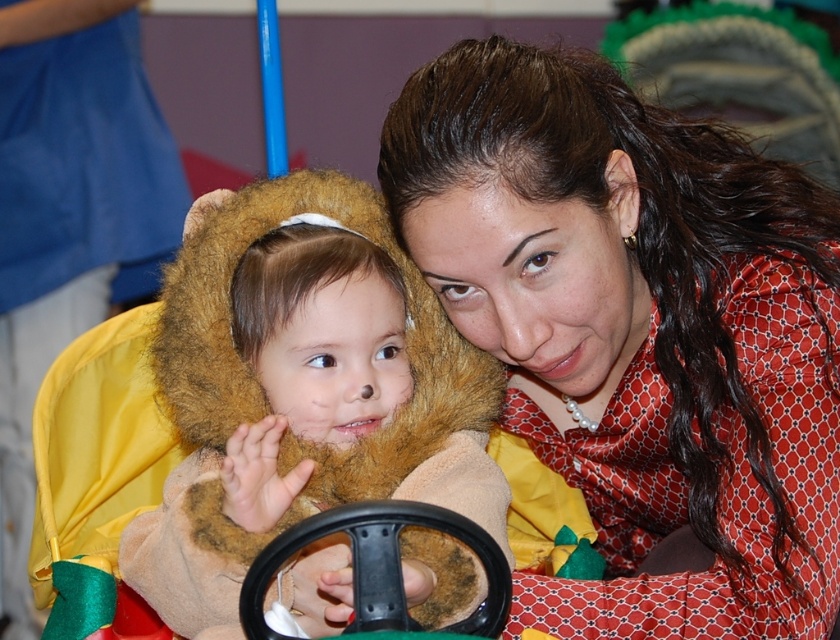
Can you confirm if smooth red blouse at upper right is shorter than fuzzy brown bear at center?

Incorrect, smooth red blouse at upper right's height does not fall short of fuzzy brown bear at center's.

Is smooth red blouse at upper right further to camera compared to fuzzy brown bear at center?

Yes, smooth red blouse at upper right is further from the viewer.

Is point (609, 163) closer to viewer compared to point (193, 381)?

No, it is not.

Find the location of `smooth red blouse at upper right`. smooth red blouse at upper right is located at coordinates (638, 330).